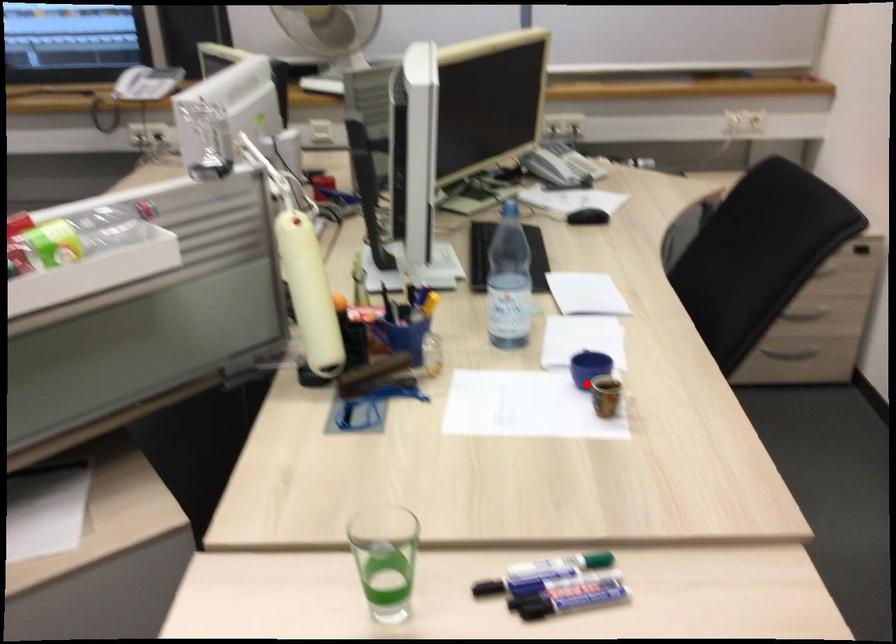
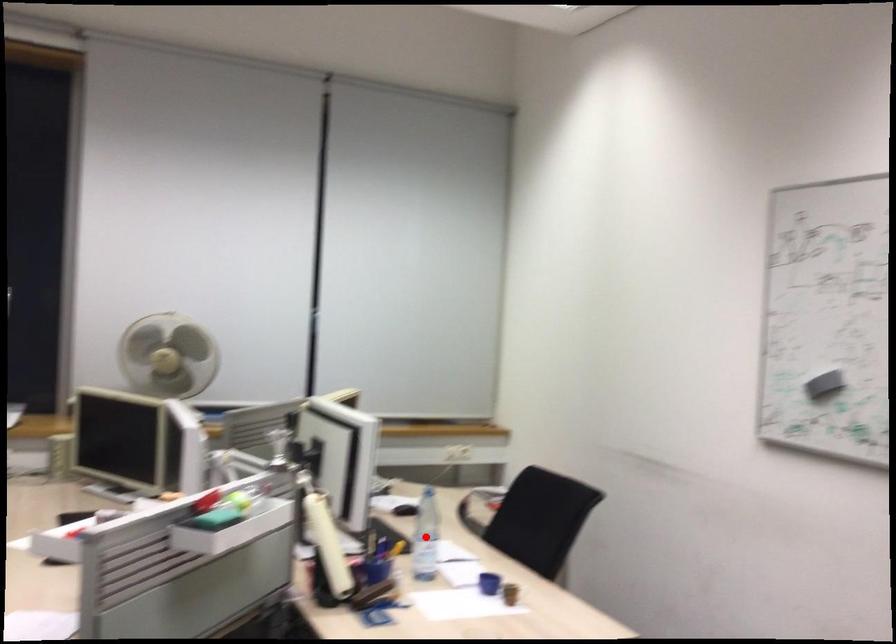
I am providing you with two images of the same scene from different viewpoints. A red point is marked on the first image and another point is marked on the second image. Does the point marked in image1 correspond to the same location as the one in image2?

No